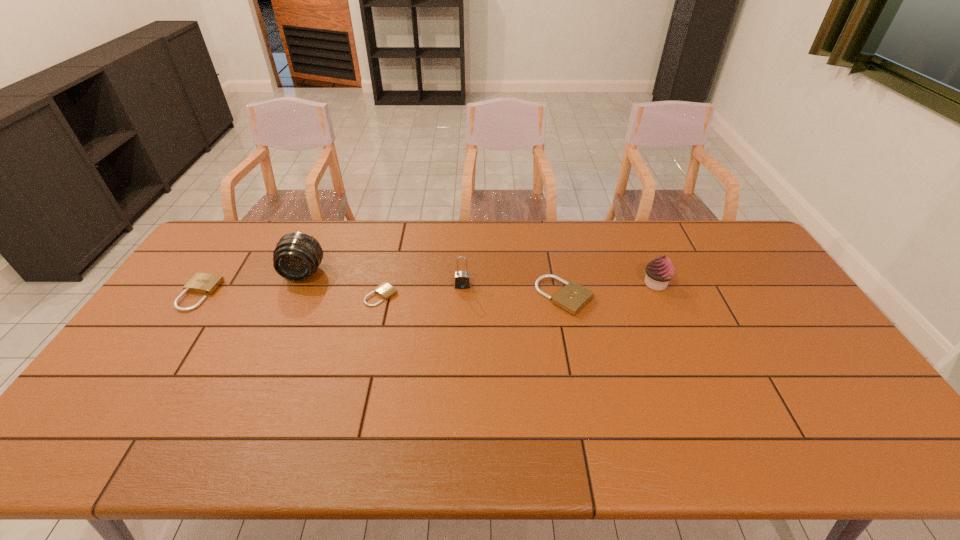
Image resolution: width=960 pixels, height=540 pixels. I want to click on the third tallest padlock, so click(201, 283).

In order to click on the leftmost object in this screenshot , I will do `click(201, 283)`.

This screenshot has height=540, width=960. I want to click on the shortest padlock, so click(x=385, y=290).

At what (x,y) coordinates should I click in order to perform the action: click on the shortest object. Please return your answer as a coordinate pair (x, y). Looking at the image, I should click on (385, 290).

Find the location of a particular element. the rightmost padlock is located at coordinates (573, 297).

At what (x,y) coordinates should I click in order to perform the action: click on the tallest object. Please return your answer as a coordinate pair (x, y). The height and width of the screenshot is (540, 960). Looking at the image, I should click on (297, 255).

What are the coordinates of `telephoto lens` in the screenshot? It's located at (297, 255).

Where is `the rightmost object`? Image resolution: width=960 pixels, height=540 pixels. the rightmost object is located at coordinates (659, 272).

Identify the location of the tallest padlock. The width and height of the screenshot is (960, 540). (462, 280).

The height and width of the screenshot is (540, 960). Find the location of `the third object from right to left`. the third object from right to left is located at coordinates (462, 280).